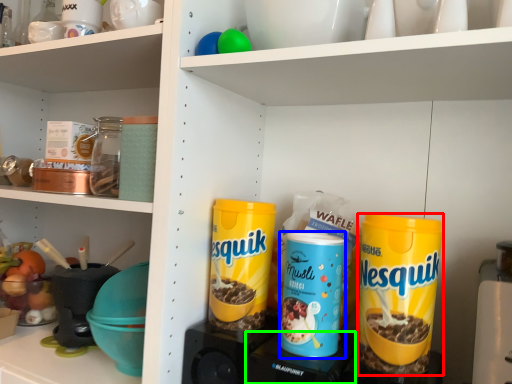
Question: Based on their relative distances, which object is farther from cereal (highlighted by a red box)? Choose from product (highlighted by a blue box) and appliance (highlighted by a green box).

Choices:
 (A) product
 (B) appliance

Answer: (B)